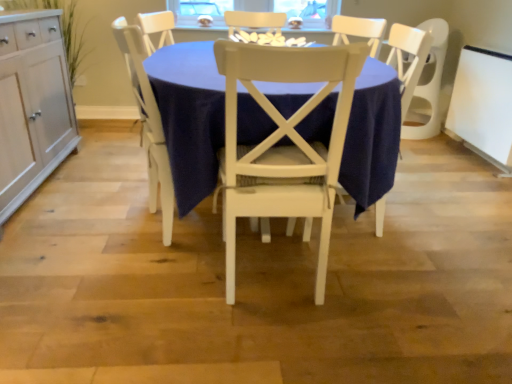
Question: From the image's perspective, is white wood chair at center, the first chair in the left-to-right sequence, under white painted wood chair at center, arranged as the 1th chair when viewed from the right?

Choices:
 (A) no
 (B) yes

Answer: (A)

Question: Does white wood chair at center, the first chair in the left-to-right sequence, turn towards white painted wood chair at center, arranged as the 1th chair when viewed from the right?

Choices:
 (A) yes
 (B) no

Answer: (B)

Question: Would you say white wood chair at center, the first chair in the left-to-right sequence, is a long distance from white painted wood chair at center, arranged as the 1th chair when viewed from the right?

Choices:
 (A) yes
 (B) no

Answer: (B)

Question: Considering the relative sizes of white wood chair at center, the first chair in the left-to-right sequence, and white painted wood chair at center, placed as the 2th chair when sorted from left to right, in the image provided, is white wood chair at center, the first chair in the left-to-right sequence, smaller than white painted wood chair at center, placed as the 2th chair when sorted from left to right,?

Choices:
 (A) yes
 (B) no

Answer: (A)

Question: From the image's perspective, does white wood chair at center, which ranks as the second chair in right-to-left order, appear higher than white painted wood chair at center, placed as the 2th chair when sorted from left to right?

Choices:
 (A) yes
 (B) no

Answer: (A)

Question: From a real-world perspective, is white wood chair at center, the first chair in the left-to-right sequence, over white painted wood chair at center, placed as the 2th chair when sorted from left to right?

Choices:
 (A) no
 (B) yes

Answer: (A)

Question: Is white wood chair at center, the first chair in the left-to-right sequence, behind white wood cabinet at left?

Choices:
 (A) no
 (B) yes

Answer: (B)

Question: Is white wood chair at center, the first chair in the left-to-right sequence, in contact with white wood cabinet at left?

Choices:
 (A) no
 (B) yes

Answer: (A)

Question: Can you confirm if white wood chair at center, which ranks as the second chair in right-to-left order, is bigger than white wood cabinet at left?

Choices:
 (A) yes
 (B) no

Answer: (B)

Question: Is white wood chair at center, the first chair in the left-to-right sequence, looking in the opposite direction of white wood cabinet at left?

Choices:
 (A) no
 (B) yes

Answer: (B)

Question: Does white wood chair at center, the first chair in the left-to-right sequence, have a greater width compared to white wood cabinet at left?

Choices:
 (A) no
 (B) yes

Answer: (A)

Question: Is white wood chair at center, which ranks as the second chair in right-to-left order, at the left side of white wood cabinet at left?

Choices:
 (A) yes
 (B) no

Answer: (B)

Question: Is white glossy cookies at center located outside white wood chair at center?

Choices:
 (A) no
 (B) yes

Answer: (B)